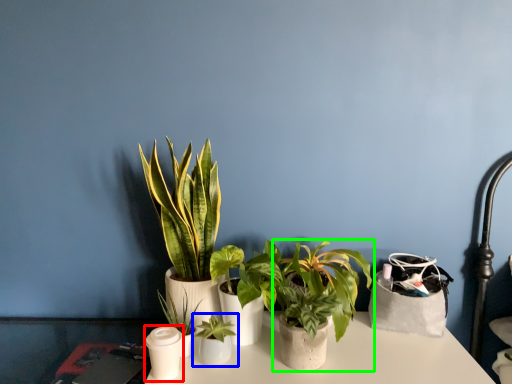
Question: Based on their relative distances, which object is farther from candle holder (highlighted by a red box)? Choose from houseplant (highlighted by a blue box) and houseplant (highlighted by a green box).

Choices:
 (A) houseplant
 (B) houseplant

Answer: (B)